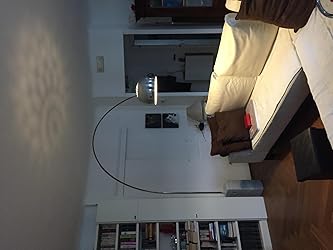
The image size is (333, 250). I want to click on wall, so click(x=111, y=153).